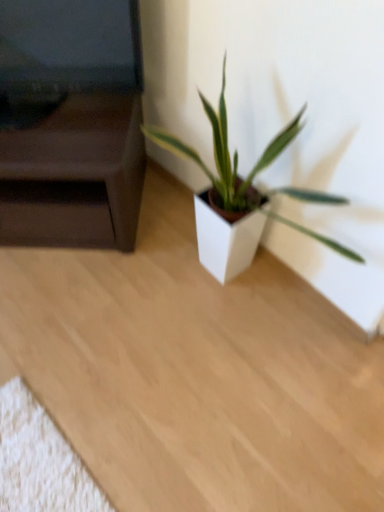
I want to click on vacant space to the left of white matte planter at center, so click(124, 307).